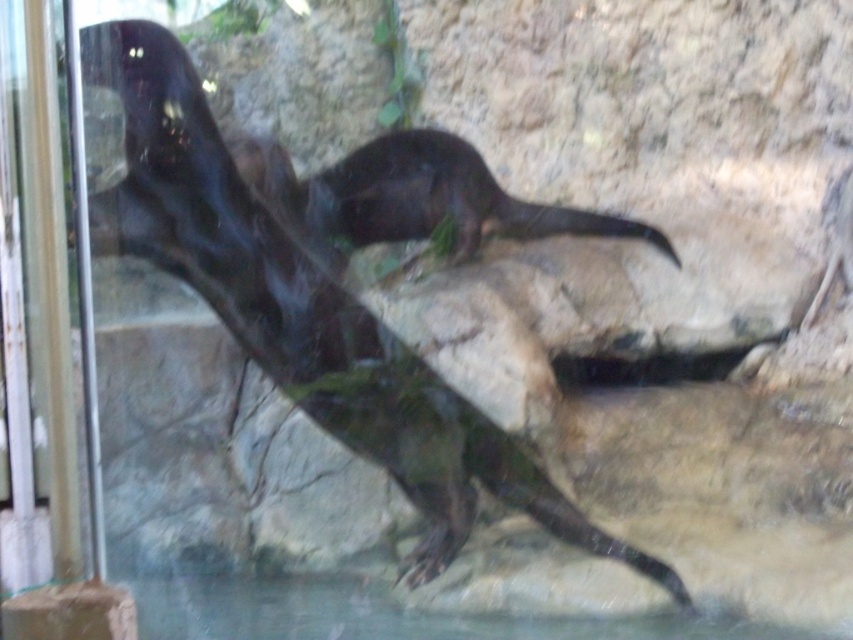
Question: Which point is farther from the camera taking this photo?

Choices:
 (A) (242, 193)
 (B) (352, 230)

Answer: (B)

Question: Which object appears closest to the camera in this image?

Choices:
 (A) shiny black otter at center
 (B) shiny dark fur otter at center

Answer: (A)

Question: Can you confirm if shiny black otter at center is smaller than shiny dark fur otter at center?

Choices:
 (A) yes
 (B) no

Answer: (B)

Question: Can you confirm if shiny black otter at center is positioned to the left of shiny dark fur otter at center?

Choices:
 (A) no
 (B) yes

Answer: (B)

Question: Where is shiny black otter at center located in relation to shiny dark fur otter at center in the image?

Choices:
 (A) left
 (B) right

Answer: (A)